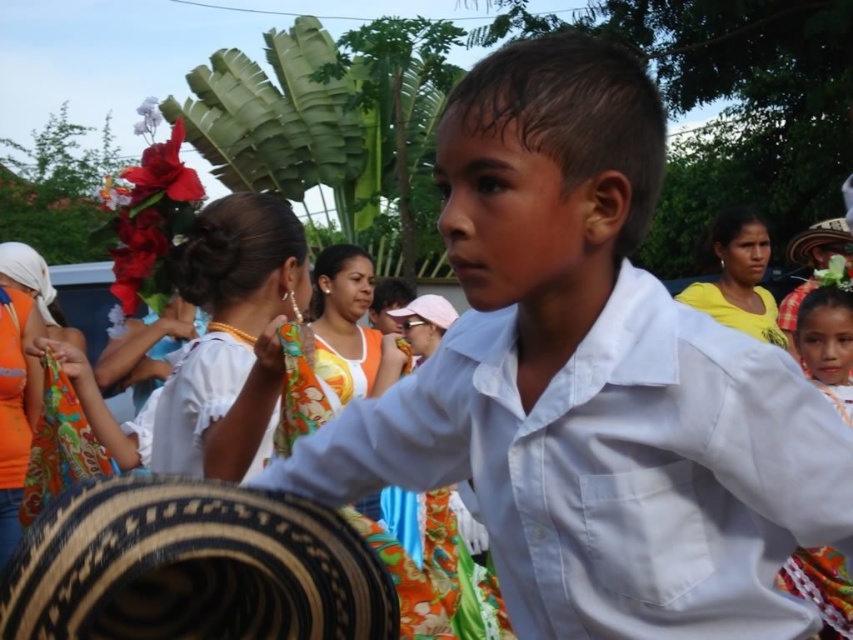
Between white matte shirt at center and white cotton shirt at center, which one has less height?

With less height is white cotton shirt at center.

Can you confirm if white matte shirt at center is positioned above white cotton shirt at center?

Actually, white matte shirt at center is below white cotton shirt at center.

The height and width of the screenshot is (640, 853). What are the coordinates of `white matte shirt at center` in the screenshot? It's located at (592, 380).

Locate an element on the screen. The width and height of the screenshot is (853, 640). white matte shirt at center is located at coordinates (592, 380).

In the scene shown: Who is more forward, (234, 486) or (809, 298)?

Positioned in front is point (234, 486).

Looking at this image, between black woven sombrero at lower left and white cotton shirt at center, which one appears on the right side from the viewer's perspective?

white cotton shirt at center

Is point (132, 552) farther from viewer compared to point (833, 349)?

No, it is not.

Where is `black woven sombrero at lower left`? black woven sombrero at lower left is located at coordinates (192, 566).

Does white matte shirt at center have a lesser height compared to black woven sombrero at lower left?

Incorrect, white matte shirt at center's height does not fall short of black woven sombrero at lower left's.

Between white matte shirt at center and black woven sombrero at lower left, which one is positioned higher?

white matte shirt at center is higher up.

Which is behind, point (558, 595) or point (235, 600)?

Point (235, 600)

Where is `white matte shirt at center`? This screenshot has height=640, width=853. white matte shirt at center is located at coordinates (592, 380).